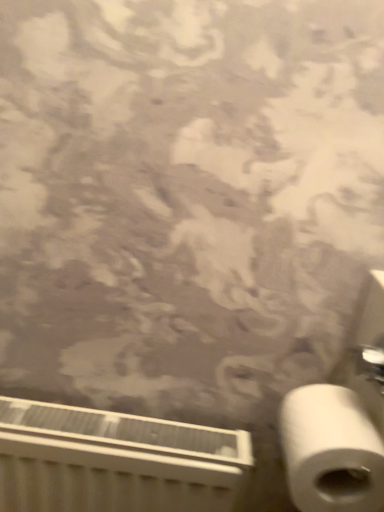
Question: Considering the positions of white plastic radiator at lower left and white matte toilet paper at lower right in the image, is white plastic radiator at lower left bigger or smaller than white matte toilet paper at lower right?

Choices:
 (A) big
 (B) small

Answer: (A)

Question: Considering their positions, is white plastic radiator at lower left located in front of or behind white matte toilet paper at lower right?

Choices:
 (A) front
 (B) behind

Answer: (B)

Question: From the image's perspective, relative to white matte toilet paper at lower right, is white plastic radiator at lower left above or below?

Choices:
 (A) below
 (B) above

Answer: (A)

Question: Considering the relative positions of white matte toilet paper at lower right and white plastic radiator at lower left in the image provided, is white matte toilet paper at lower right to the left or to the right of white plastic radiator at lower left?

Choices:
 (A) right
 (B) left

Answer: (A)

Question: Considering the positions of point (344, 393) and point (160, 424), is point (344, 393) closer or farther from the camera than point (160, 424)?

Choices:
 (A) farther
 (B) closer

Answer: (B)

Question: Relative to white plastic radiator at lower left, is white matte toilet paper at lower right in front or behind?

Choices:
 (A) behind
 (B) front

Answer: (B)

Question: In terms of width, does white matte toilet paper at lower right look wider or thinner when compared to white plastic radiator at lower left?

Choices:
 (A) thin
 (B) wide

Answer: (B)